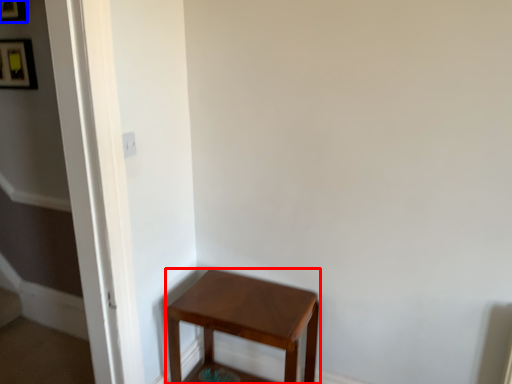
Question: Which object appears closest to the camera in this image, stool (highlighted by a red box) or picture frame (highlighted by a blue box)?

Choices:
 (A) stool
 (B) picture frame

Answer: (A)